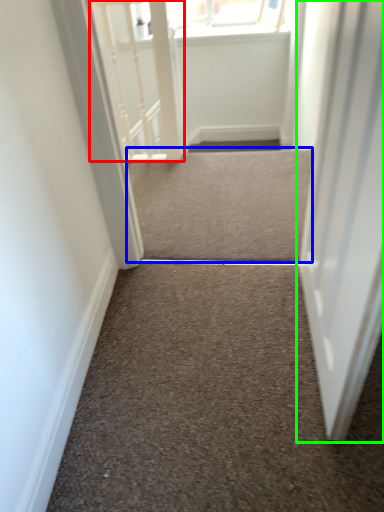
Question: Which object is positioned farthest from rail (highlighted by a red box)? Select from stairwell (highlighted by a blue box) and door (highlighted by a green box).

Choices:
 (A) stairwell
 (B) door

Answer: (B)